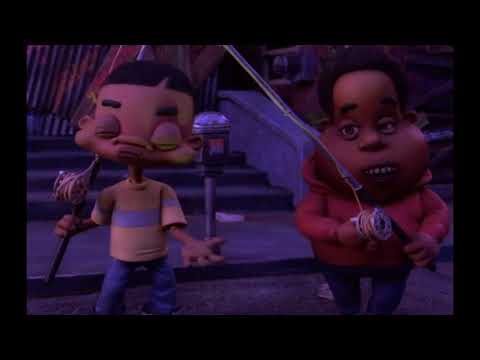
The width and height of the screenshot is (480, 360). In order to click on stairs in this screenshot , I will do `click(225, 177)`.